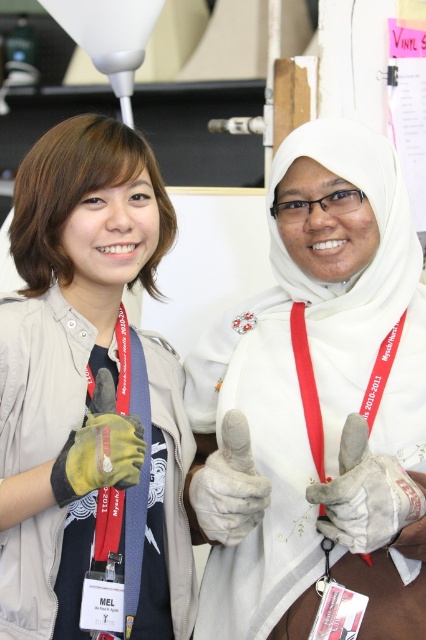
Is point (316, 284) positioned behind point (149, 221)?

Yes, point (316, 284) is farther from viewer.

Based on the photo, between white matte gloves at center and matte gray jacket at center, which one appears on the right side from the viewer's perspective?

white matte gloves at center is more to the right.

What are the coordinates of `white matte gloves at center` in the screenshot? It's located at (316, 403).

Which is behind, point (149, 486) or point (367, 394)?

Point (149, 486)

Where is `matte gray jacket at center`? The width and height of the screenshot is (426, 640). matte gray jacket at center is located at coordinates (86, 385).

Can you confirm if white matte gloves at center is taller than red fabric lanyard at center?

Correct, white matte gloves at center is much taller as red fabric lanyard at center.

Can you confirm if white matte gloves at center is shorter than red fabric lanyard at center?

No.

Which is behind, point (307, 180) or point (383, 352)?

Point (383, 352)

The image size is (426, 640). What are the coordinates of `white matte gloves at center` in the screenshot? It's located at (316, 403).